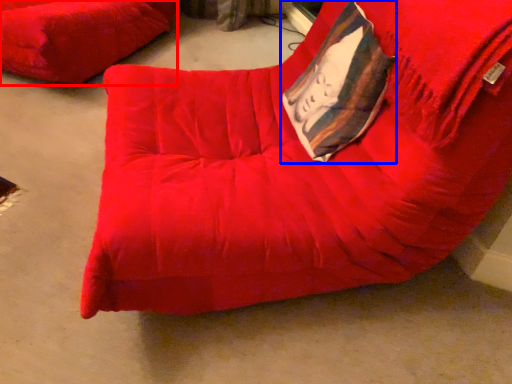
Question: Which object appears farthest to the camera in this image, furniture (highlighted by a red box) or throw pillow (highlighted by a blue box)?

Choices:
 (A) furniture
 (B) throw pillow

Answer: (A)